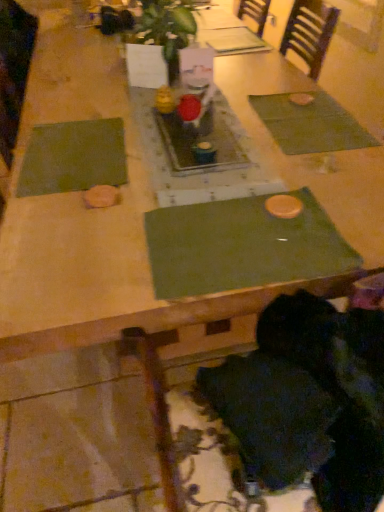
This screenshot has height=512, width=384. Find the location of `free space behind green fabric place mat at center, which is counted as the 2th place mat, starting from the right`. free space behind green fabric place mat at center, which is counted as the 2th place mat, starting from the right is located at coordinates (231, 168).